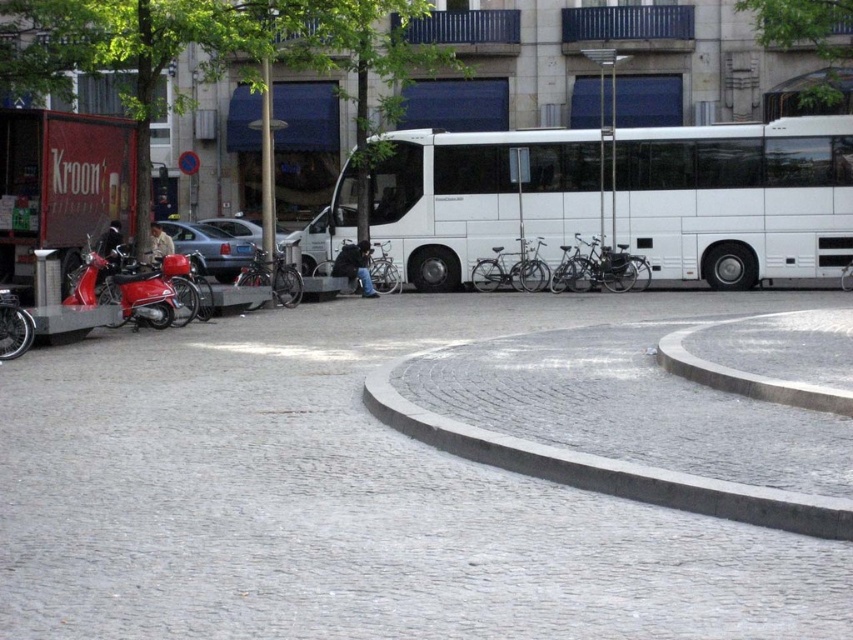
Does white glossy bus at center appear under gray concrete curb at lower center?

Incorrect, white glossy bus at center is not positioned below gray concrete curb at lower center.

Is point (502, 189) in front of point (485, 436)?

No, (502, 189) is behind (485, 436).

Where is `white glossy bus at center`? Image resolution: width=853 pixels, height=640 pixels. white glossy bus at center is located at coordinates (737, 198).

Where is `gray cobblestone pavement at center`? The height and width of the screenshot is (640, 853). gray cobblestone pavement at center is located at coordinates (352, 497).

Does gray cobblestone pavement at center lie in front of gray concrete curb at lower center?

Yes, it is in front of gray concrete curb at lower center.

Can you confirm if gray cobblestone pavement at center is shorter than gray concrete curb at lower center?

No, gray cobblestone pavement at center is not shorter than gray concrete curb at lower center.

What do you see at coordinates (352, 497) in the screenshot?
I see `gray cobblestone pavement at center` at bounding box center [352, 497].

The width and height of the screenshot is (853, 640). Find the location of `gray cobblestone pavement at center`. gray cobblestone pavement at center is located at coordinates (352, 497).